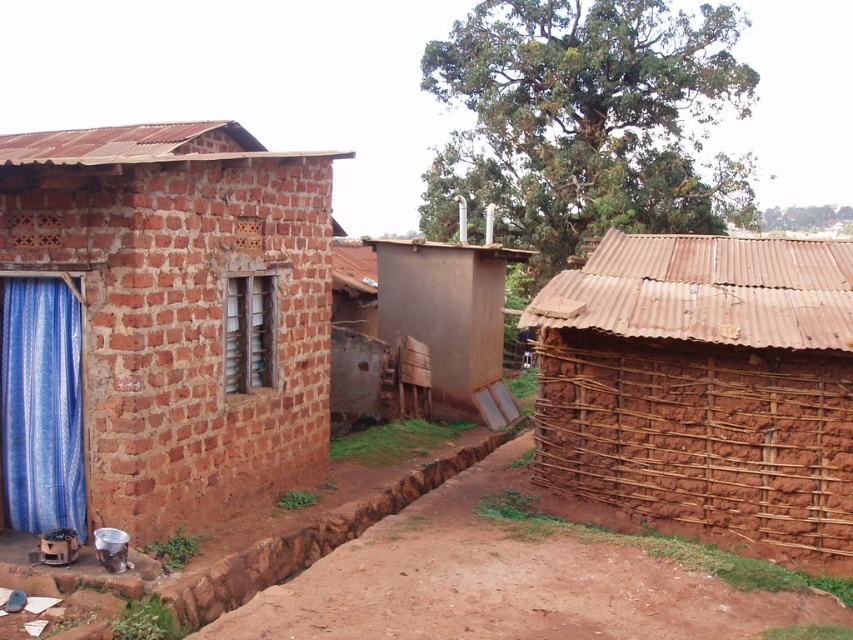
Which is behind, point (123, 483) or point (35, 358)?

Positioned behind is point (35, 358).

Is brown brick house at left below blue woven curtain at left?

Incorrect, brown brick house at left is not positioned below blue woven curtain at left.

Is point (49, 518) less distant than point (6, 412)?

Yes, point (49, 518) is closer to viewer.

In order to click on brown brick house at left in this screenshot , I will do `click(160, 323)`.

Does brown mud hut at right appear on the left side of blue woven curtain at left?

In fact, brown mud hut at right is to the right of blue woven curtain at left.

Looking at this image, between brown mud hut at right and blue woven curtain at left, which one has more height?

Standing taller between the two is brown mud hut at right.

This screenshot has height=640, width=853. Find the location of `brown mud hut at right`. brown mud hut at right is located at coordinates (703, 385).

Image resolution: width=853 pixels, height=640 pixels. What do you see at coordinates (160, 323) in the screenshot? I see `brown brick house at left` at bounding box center [160, 323].

Is brown brick house at left to the left of brown mud hut at right from the viewer's perspective?

Correct, you'll find brown brick house at left to the left of brown mud hut at right.

Does point (200, 321) come closer to viewer compared to point (743, 502)?

That is True.

Find the location of `brown brick house at left`. brown brick house at left is located at coordinates (160, 323).